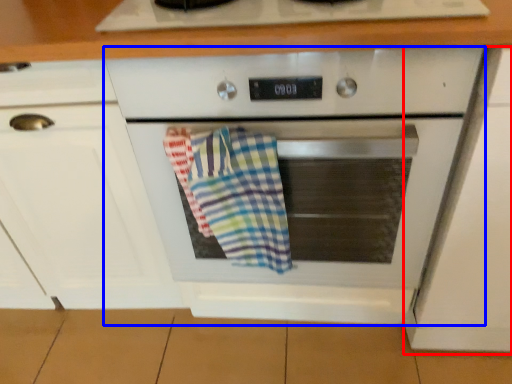
Question: Among these objects, which one is nearest to the camera, cabinetry (highlighted by a red box) or oven (highlighted by a blue box)?

Choices:
 (A) cabinetry
 (B) oven

Answer: (A)